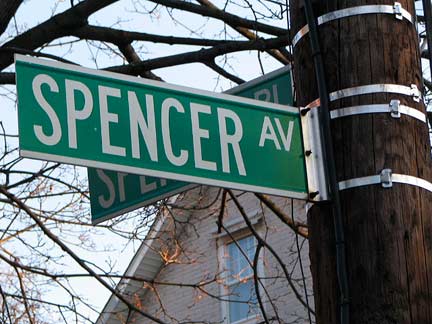
The height and width of the screenshot is (324, 432). I want to click on the lower window pane, so click(242, 297).